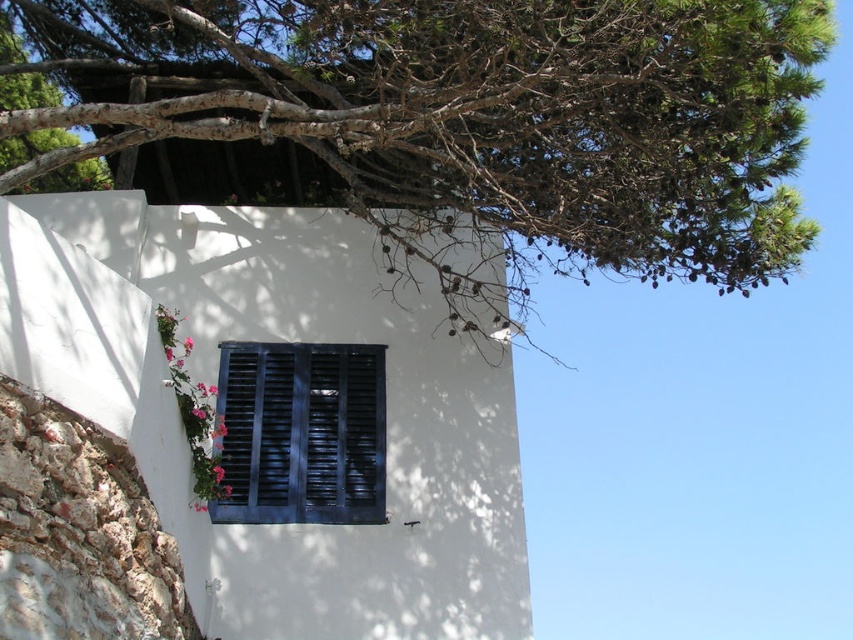
Where is the green leafy tree at upper center located in the image?

The green leafy tree at upper center is located at point [482,122] in the image.

In the scene shown: You are standing in front of the building and notice the green leafy tree at upper center and the dark wood shutters at center. Which object is positioned higher on the wall?

The green leafy tree at upper center is located above the dark wood shutters at center, so it is positioned higher on the wall.